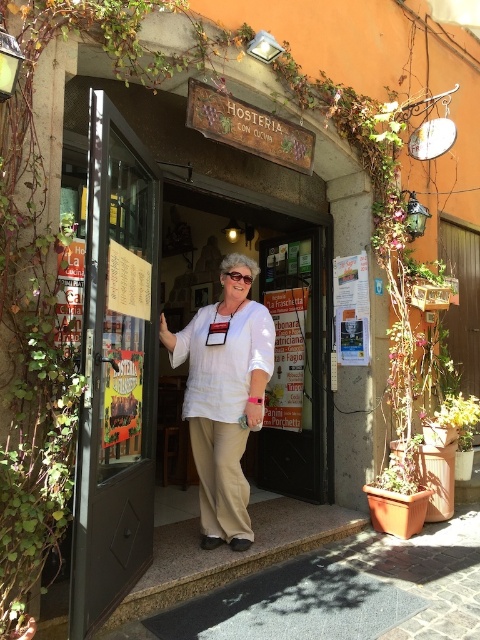
Can you confirm if white cotton shirt at center is thinner than black wooden door at center?

In fact, white cotton shirt at center might be wider than black wooden door at center.

Does white cotton shirt at center appear on the left side of black wooden door at center?

Indeed, white cotton shirt at center is positioned on the left side of black wooden door at center.

Who is more forward, (245, 285) or (323, 280)?

Point (245, 285) is in front.

Where is `white cotton shirt at center`? white cotton shirt at center is located at coordinates (224, 397).

Looking at this image, is dark brown wood door at left behind black wooden door at center?

No, dark brown wood door at left is in front of black wooden door at center.

Is point (133, 560) farther from viewer compared to point (295, 368)?

No.

Who is more forward, (108,426) or (311,449)?

Positioned in front is point (108,426).

At what (x,y) coordinates should I click in order to perform the action: click on dark brown wood door at left. Please return your answer as a coordinate pair (x, y). Image resolution: width=480 pixels, height=640 pixels. Looking at the image, I should click on (116, 371).

Is dark brown wood door at left to the right of white fabric door at center from the viewer's perspective?

No, dark brown wood door at left is not to the right of white fabric door at center.

Identify the location of dark brown wood door at left. This screenshot has width=480, height=640. (116, 371).

This screenshot has width=480, height=640. What do you see at coordinates (116, 371) in the screenshot?
I see `dark brown wood door at left` at bounding box center [116, 371].

Where is `dark brown wood door at left`? The image size is (480, 640). dark brown wood door at left is located at coordinates (116, 371).